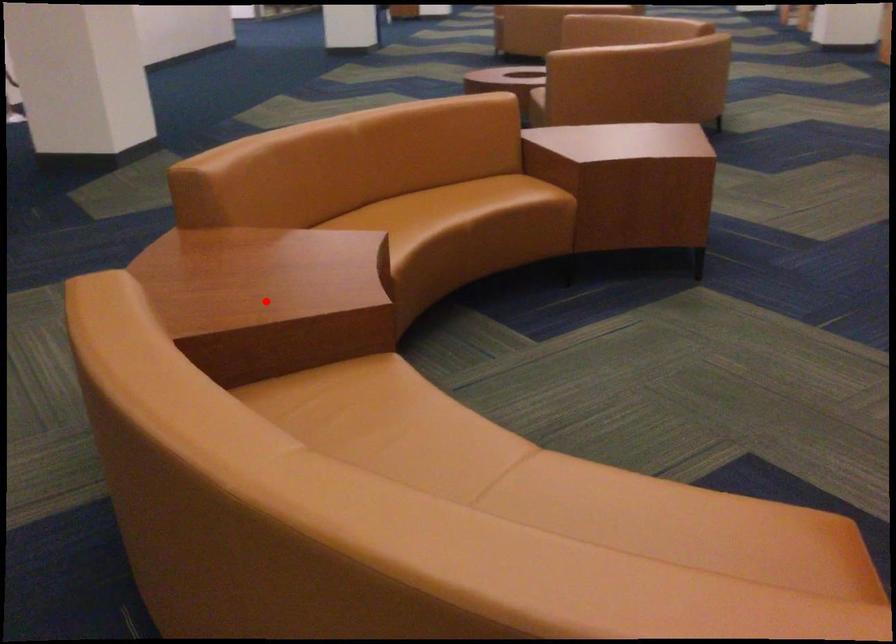
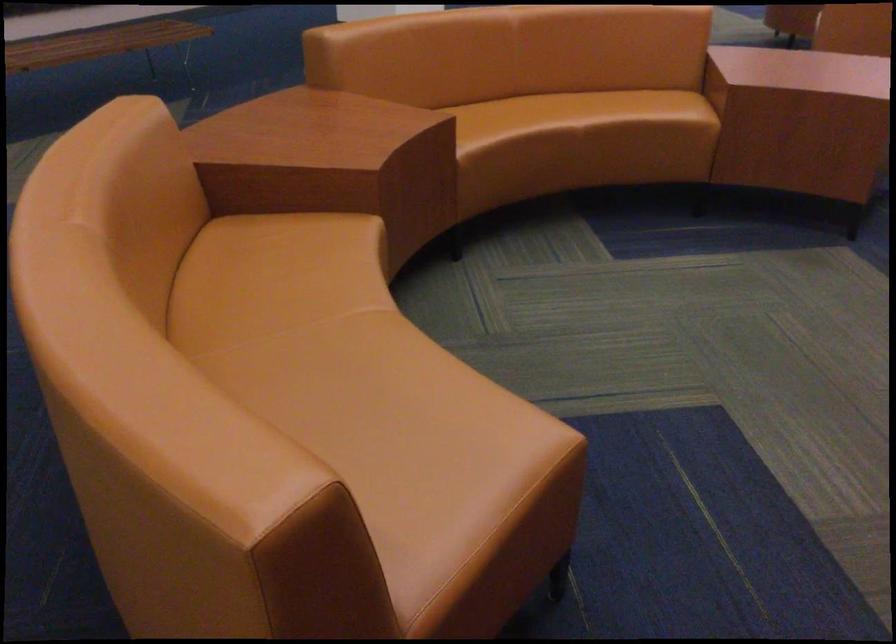
The point at the highlighted location is marked in the first image. Where is the corresponding point in the second image?

(297, 151)